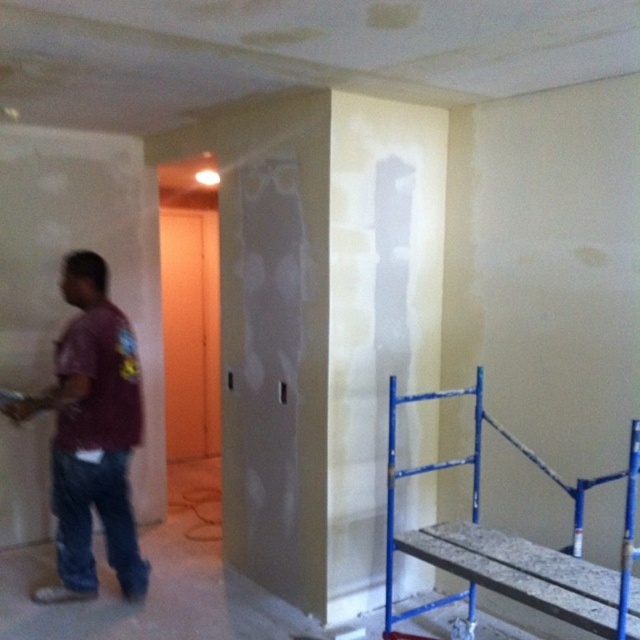
You are a painter who needs to reach the ceiling to touch up some spots. You have a ladder that is 2.5 meters tall. The maroon fabric shirt at left is 2.84 meters away from the ceiling. Can you safely reach the ceiling with your ladder?

The maroon fabric shirt at left is 2.84 meters away from the ceiling. Since the ladder is only 2.5 meters tall, it is not tall enough to reach the ceiling from the maroon fabric shirt at left. You would need a taller ladder to safely reach the ceiling.

Consider the image. You are an interior designer assessing the renovation progress. You notice the maroon fabric shirt at left and the blue metal scaffolding at lower right. Which object takes up more area in the image?

The blue metal scaffolding at lower right takes up more area in the image than the maroon fabric shirt at left.